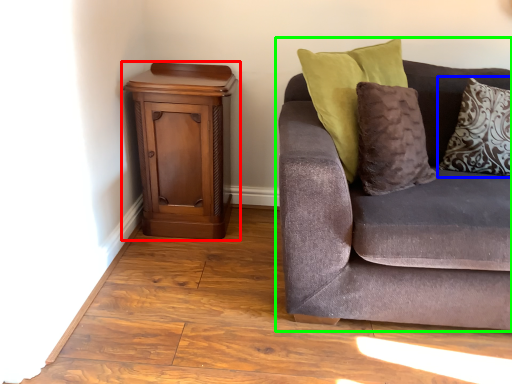
Question: Which object is the farthest from nightstand (highlighted by a red box)? Choose among these: pillow (highlighted by a blue box) or studio couch (highlighted by a green box).

Choices:
 (A) pillow
 (B) studio couch

Answer: (A)